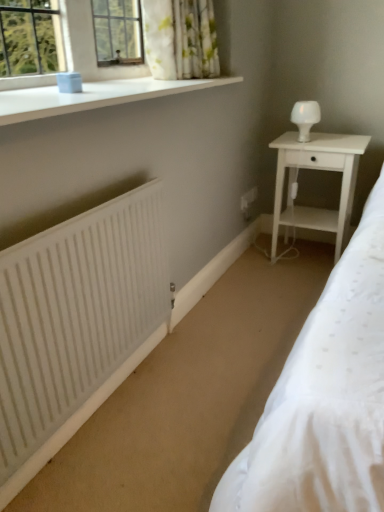
Where is `free location in front of white matte radiator at lower left`? free location in front of white matte radiator at lower left is located at coordinates (123, 456).